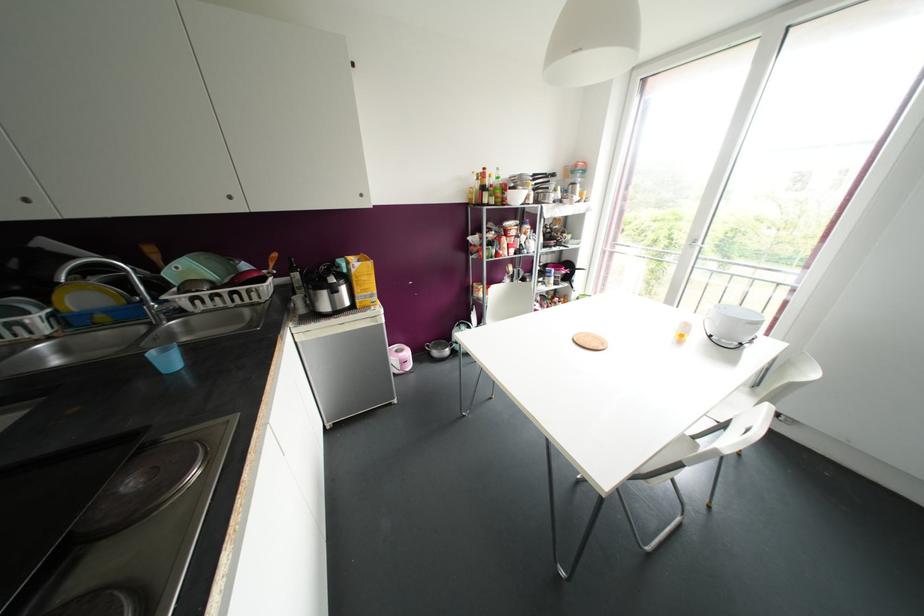
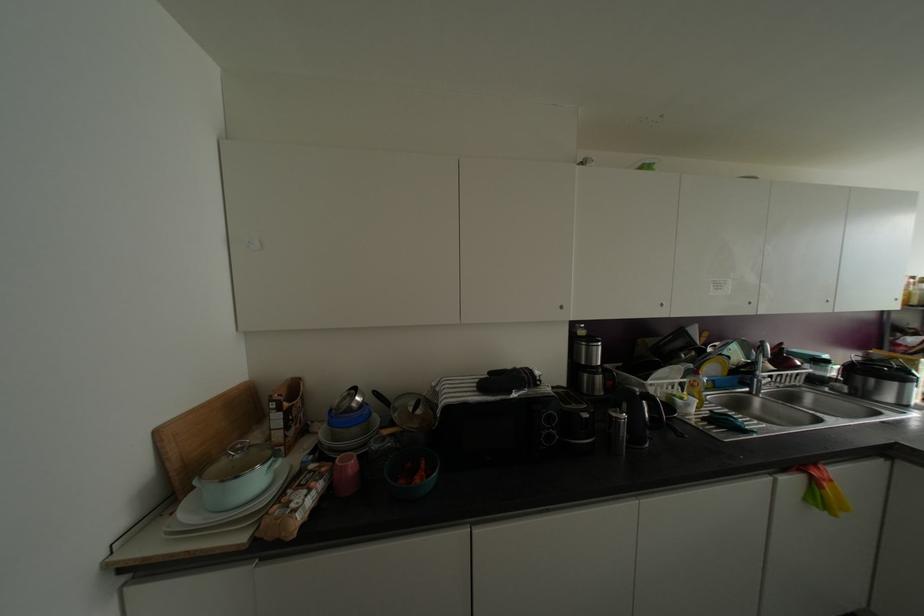
Question: In a continuous first-person perspective shot, in which direction is the camera moving?

Choices:
 (A) Left
 (B) Right
 (C) Forward
 (D) Backward

Answer: (A)